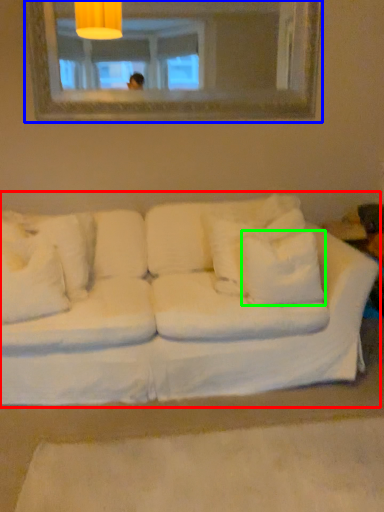
Question: Based on their relative distances, which object is farther from studio couch (highlighted by a red box)? Choose from mirror (highlighted by a blue box) and pillow (highlighted by a green box).

Choices:
 (A) mirror
 (B) pillow

Answer: (A)